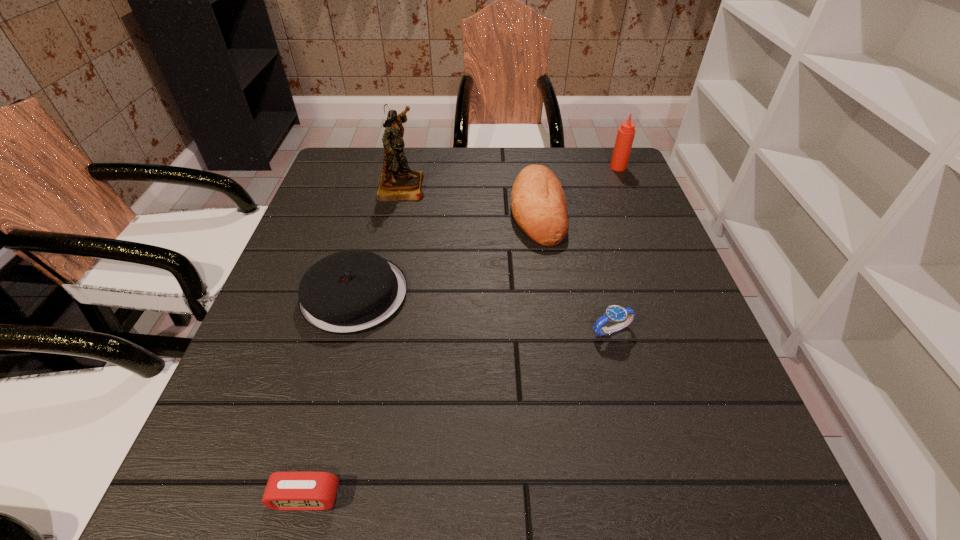
Locate an element on the screen. The image size is (960, 540). free point located on the front of the pancake is located at coordinates (324, 405).

Locate an element on the screen. This screenshot has width=960, height=540. vacant space situated 0.050m on the right of the watch is located at coordinates (660, 330).

Where is `figurine present at the far edge`? Image resolution: width=960 pixels, height=540 pixels. figurine present at the far edge is located at coordinates (398, 182).

You are a GUI agent. You are given a task and a screenshot of the screen. Output one action in this format:
    pyautogui.click(x=<x>, y=<y>)
    Task: Click on the Tabasco sauce located in the far edge section of the desktop
    
    Given the screenshot: What is the action you would take?
    626,132

Where is `bread present at the far edge`? Image resolution: width=960 pixels, height=540 pixels. bread present at the far edge is located at coordinates (539, 207).

This screenshot has height=540, width=960. In order to click on object that is at the near edge in this screenshot , I will do `click(294, 491)`.

Find the location of a particular element. This screenshot has height=540, width=960. figurine that is at the left edge is located at coordinates (398, 182).

Find the location of a particular element. The width and height of the screenshot is (960, 540). pancake at the left edge is located at coordinates (349, 292).

I want to click on alarm clock positioned at the left edge, so click(x=294, y=491).

You are a GUI agent. You are given a task and a screenshot of the screen. Output one action in this format:
    pyautogui.click(x=<x>, y=<y>)
    Task: Click on the Tabasco sauce positioned at the right edge
    The width and height of the screenshot is (960, 540).
    Given the screenshot: What is the action you would take?
    pyautogui.click(x=626, y=132)